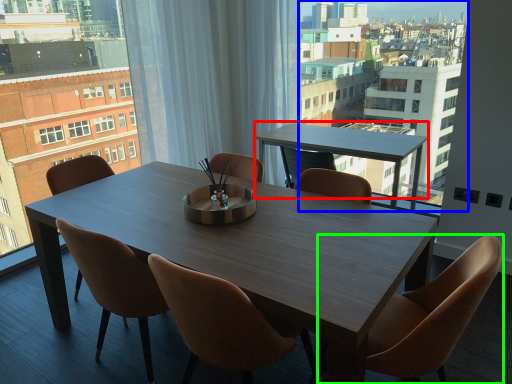
Question: Which object is the farthest from coffee table (highlighted by a red box)? Choose among these: condominium (highlighted by a blue box) or chair (highlighted by a green box).

Choices:
 (A) condominium
 (B) chair

Answer: (B)